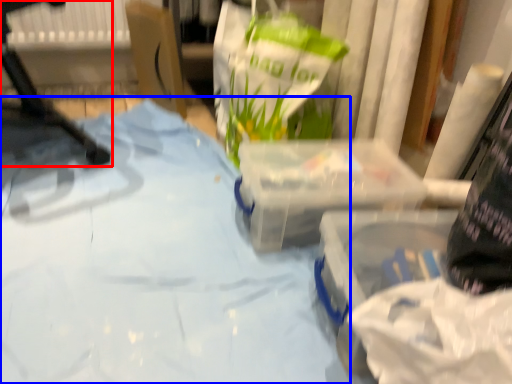
Question: Which object is further to the camera taking this photo, furniture (highlighted by a red box) or sheet (highlighted by a blue box)?

Choices:
 (A) furniture
 (B) sheet

Answer: (A)